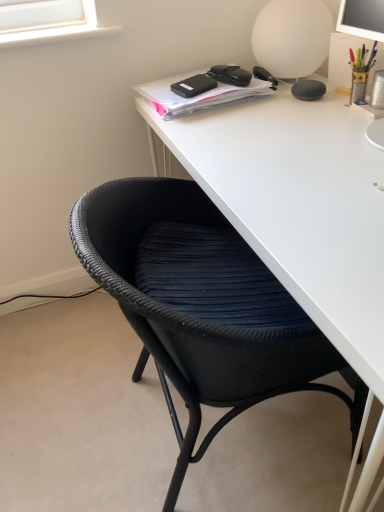
This screenshot has height=512, width=384. What are the coordinates of `free space to the left of black matte hard drive at upper center, placed as the first stationery when sorted from left to right` in the screenshot? It's located at (155, 95).